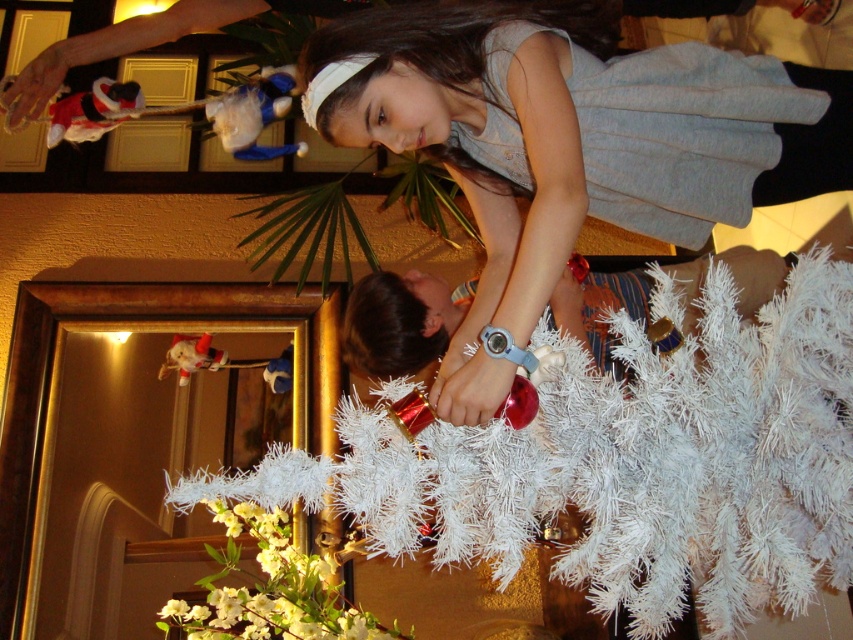
Can you confirm if velvet plush toy at upper left is smaller than velvet santa claus at upper left?

No, velvet plush toy at upper left is not smaller than velvet santa claus at upper left.

Based on the photo, who is taller, velvet plush toy at upper left or velvet santa claus at upper left?

velvet plush toy at upper left

Which is behind, point (248, 113) or point (119, 88)?

Positioned behind is point (119, 88).

Where is `velvet plush toy at upper left`? velvet plush toy at upper left is located at coordinates (254, 115).

Is velvet santa claus at upper left bigger than matte red santa at lower left?

Yes.

Does velvet santa claus at upper left have a smaller size compared to matte red santa at lower left?

No.

Which is behind, point (117, 122) or point (209, 369)?

Point (117, 122)

Locate an element on the screen. This screenshot has width=853, height=640. velvet santa claus at upper left is located at coordinates (93, 109).

Who is positioned more to the left, white artificial tree at center or velvet plush toy at center?

From the viewer's perspective, velvet plush toy at center appears more on the left side.

Who is taller, white artificial tree at center or velvet plush toy at center?

Standing taller between the two is white artificial tree at center.

I want to click on white artificial tree at center, so click(x=627, y=464).